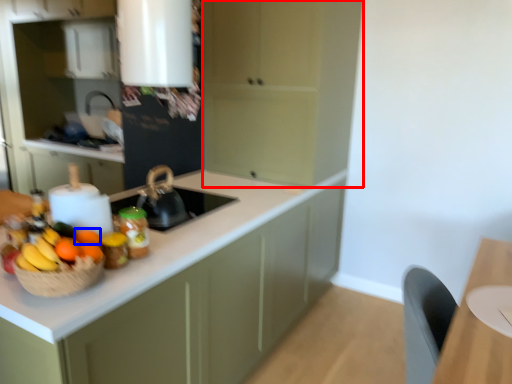
Question: Which object appears farthest to the camera in this image, cabinetry (highlighted by a red box) or orange (highlighted by a blue box)?

Choices:
 (A) cabinetry
 (B) orange

Answer: (A)